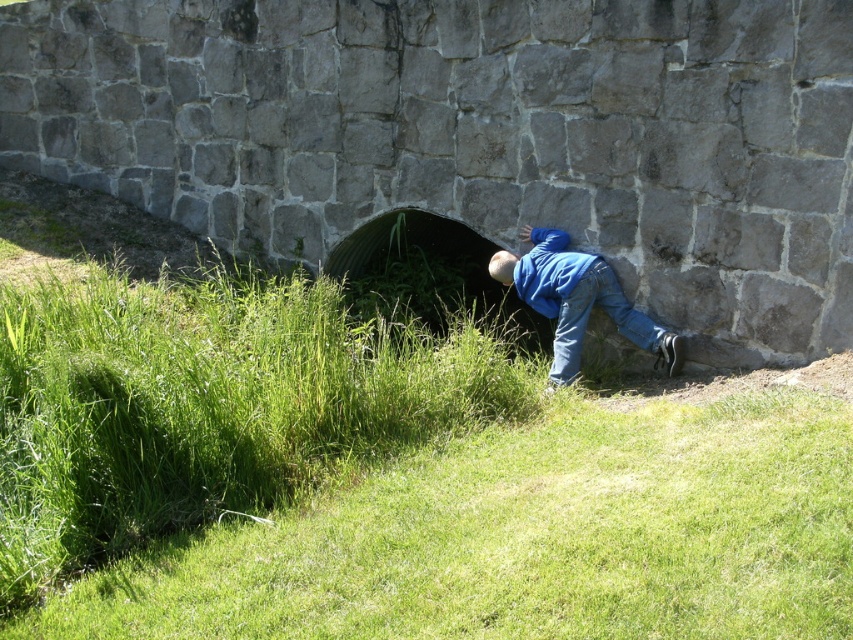
You are a safety inspector assessing the culvert site. You see the green corrugated metal tunnel at center and the blue denim jeans at lower right. Which object is closer to your current position?

The green corrugated metal tunnel at center is closer to you because it is further to the viewer than the blue denim jeans at lower right, meaning it occupies a nearer spatial position in the visual field.

Consider the image. You are standing at the entrance of the culvert and notice a point marked at coordinates (531, 532). Based on the scene description, where is this point located relative to the culvert?

The point at (531, 532) is located on green grass at lower left, which is outside the culvert entrance.